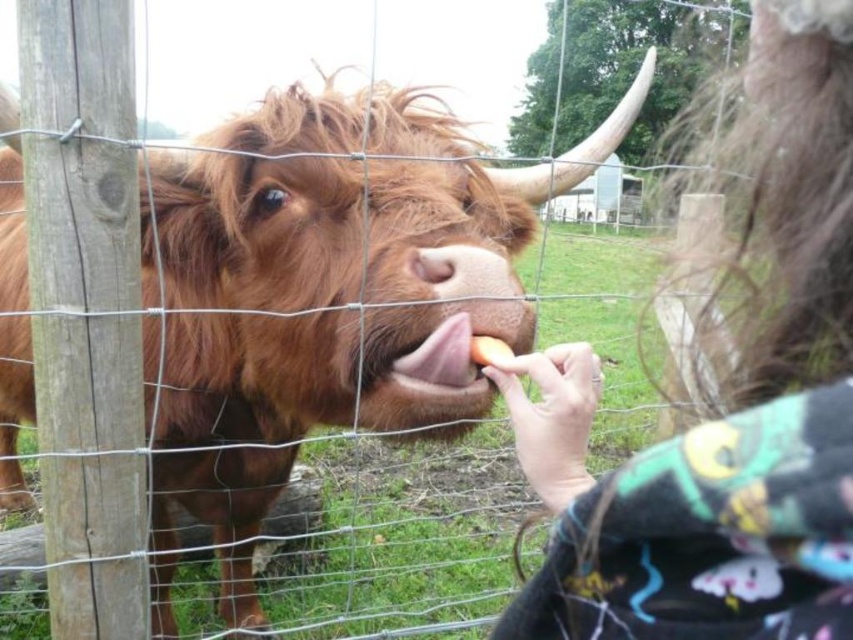
Question: Estimate the real-world distances between objects in this image. Which object is closer to the pink glossy tongue at center?

Choices:
 (A) fluffy brown hair at upper right
 (B) yellow matte apple at center

Answer: (B)

Question: Does brown fuzzy bison at center have a greater width compared to yellow matte apple at center?

Choices:
 (A) yes
 (B) no

Answer: (A)

Question: Which point appears closest to the camera in this image?

Choices:
 (A) (498, 355)
 (B) (727, 476)
 (C) (474, 348)
 (D) (497, 310)

Answer: (B)

Question: Observing the image, what is the correct spatial positioning of pink glossy tongue at center in reference to yellow matte apple at center?

Choices:
 (A) left
 (B) right

Answer: (A)

Question: Considering the real-world distances, which object is closest to the yellow matte apple at center?

Choices:
 (A) fluffy brown hair at upper right
 (B) pink glossy tongue at center
 (C) brown fuzzy bison at center

Answer: (B)

Question: Does fluffy brown hair at upper right have a lesser width compared to yellow matte apple at center?

Choices:
 (A) yes
 (B) no

Answer: (B)